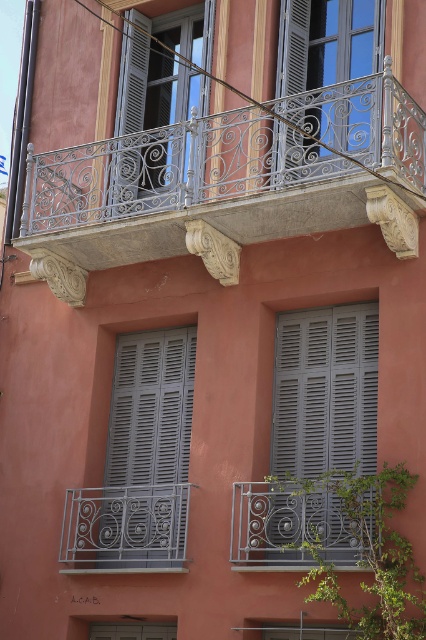
You are standing on the sidewalk in front of this building. You notice two wrought iron features. The first is the white wrought iron balcony at upper center, and the second is the dark gray wrought iron at center. Which of these two features is positioned higher up on the building?

The white wrought iron balcony at upper center is positioned higher up on the building compared to the dark gray wrought iron at center, as it is located above it.

You are an architect analyzing the building facade. You notice the white wrought iron balcony at upper center and the dark gray wrought iron at center. Which of these two objects is larger in size?

The white wrought iron balcony at upper center is bigger than the dark gray wrought iron at center.